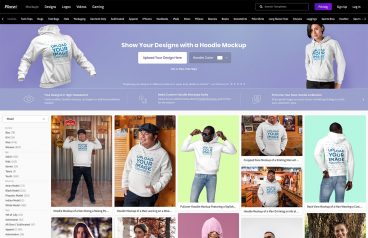
I want to click on wooden swing door, so click(122, 148).